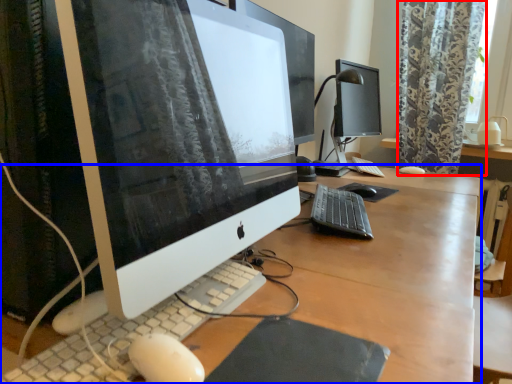
Question: Which object appears farthest to the camera in this image, curtain (highlighted by a red box) or desk (highlighted by a blue box)?

Choices:
 (A) curtain
 (B) desk

Answer: (A)